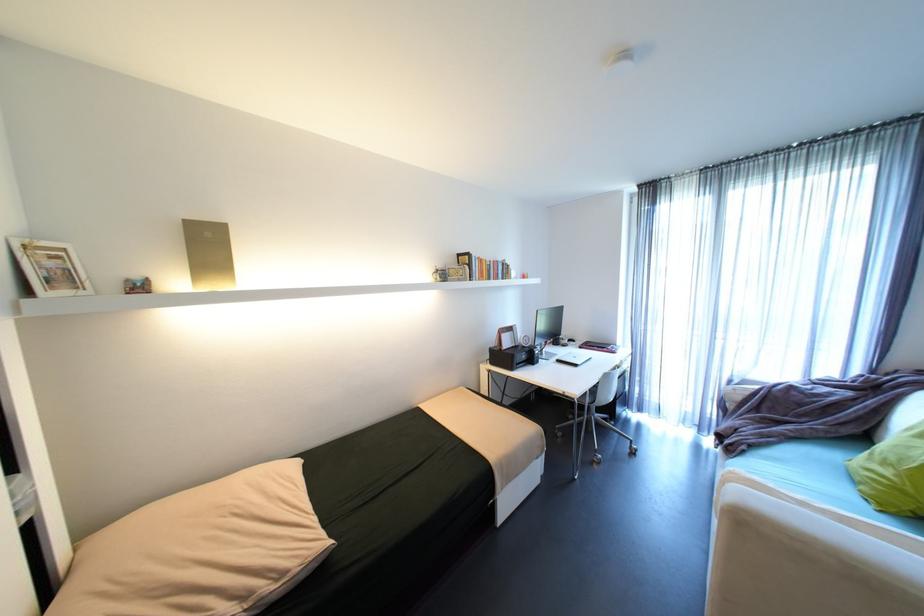
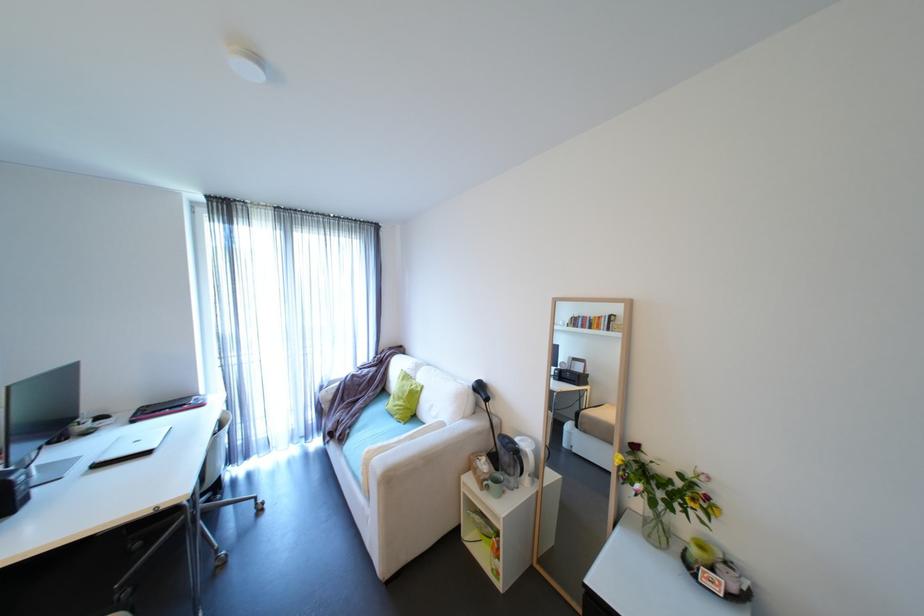
In the second image, find the point that corresponds to point (736, 448) in the first image.

(347, 438)